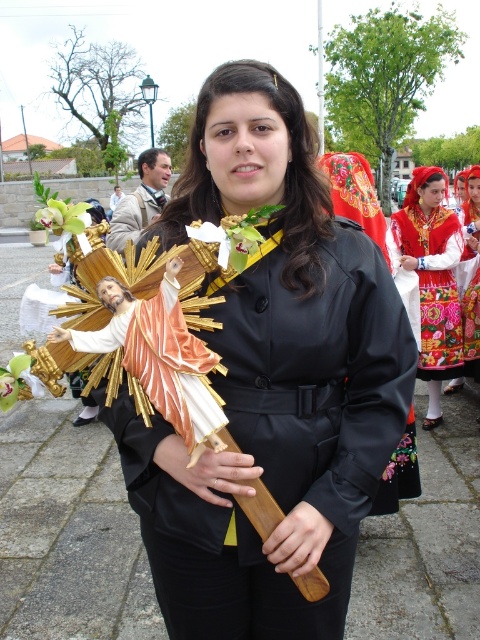
Question: Which object appears farthest from the camera in this image?

Choices:
 (A) embroidered fabric dress at center
 (B) green matte flower at upper left

Answer: (A)

Question: Which of these objects is positioned farthest from the embroidered fabric dress at center?

Choices:
 (A) green leafy flower at lower left
 (B) embroidered silk dress at center

Answer: (A)

Question: Can you confirm if embroidered fabric dress at center is thinner than embroidered silk dress at center?

Choices:
 (A) yes
 (B) no

Answer: (B)

Question: Which object appears closest to the camera in this image?

Choices:
 (A) embroidered fabric dress at center
 (B) embroidered silk dress at center
 (C) green matte flower at upper left
 (D) green leafy flower at lower left

Answer: (D)

Question: Does green leafy flower at lower left appear on the right side of green matte flower at upper left?

Choices:
 (A) no
 (B) yes

Answer: (B)

Question: Does matte black coat at center appear on the right side of embroidered silk dress at center?

Choices:
 (A) no
 (B) yes

Answer: (A)